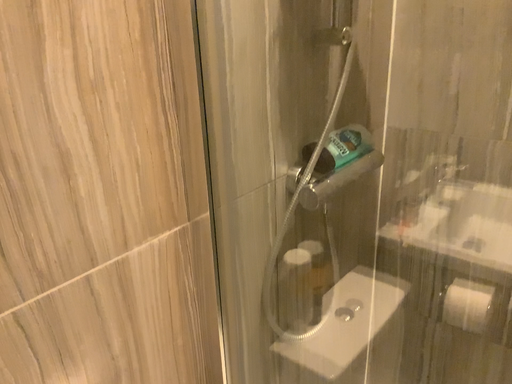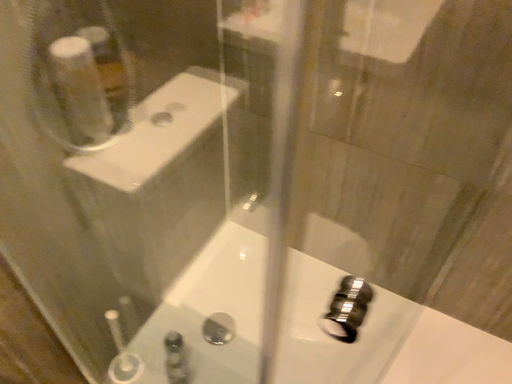
Question: Which way did the camera rotate in the video?

Choices:
 (A) rotated downward
 (B) rotated upward

Answer: (A)